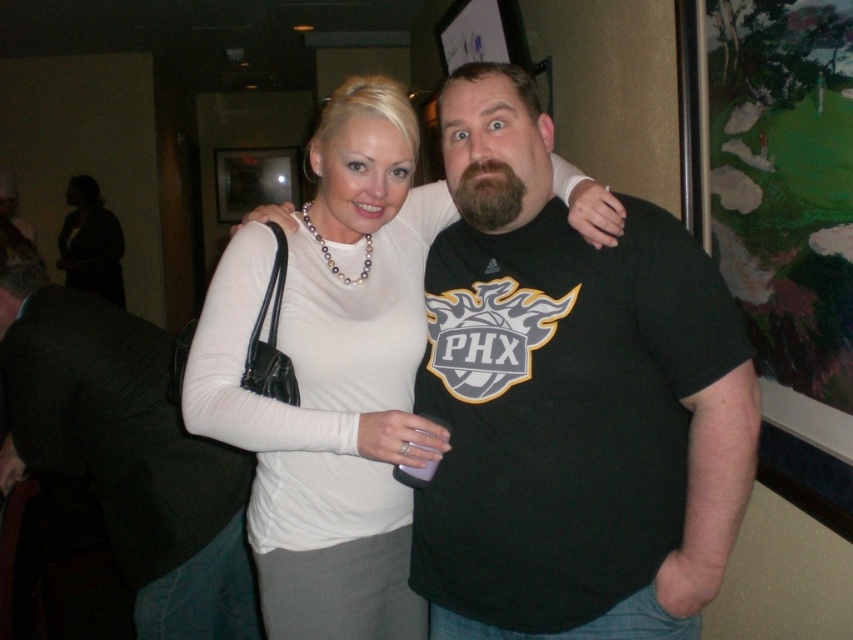
You are organizing a charity event and need to decide which garment to display first. Based on their sizes, which of the two items, the black matte jacket at center or the matte white blouse at upper center, should be placed in the spotlight first?

The black matte jacket at center has a smaller size compared to the matte white blouse at upper center, so it should be placed in the spotlight first to ensure it is visible despite its smaller size.

You are standing in front of the image and want to identify the location of the point with coordinates (x=125, y=449). Which object in the scene does this point lie on?

The point with coordinates (x=125, y=449) lies on the black matte jacket at center.

You are standing at point (376, 288) and want to take a photo of the scene. The camera you have can focus on objects within 1.5 meters. Will the camera be able to focus on the entire scene?

The distance between point (376, 288) and the camera is 1.52 meters, which is slightly beyond the camera focus range of 1.5 meters. Therefore, the camera may not be able to focus on the entire scene clearly.